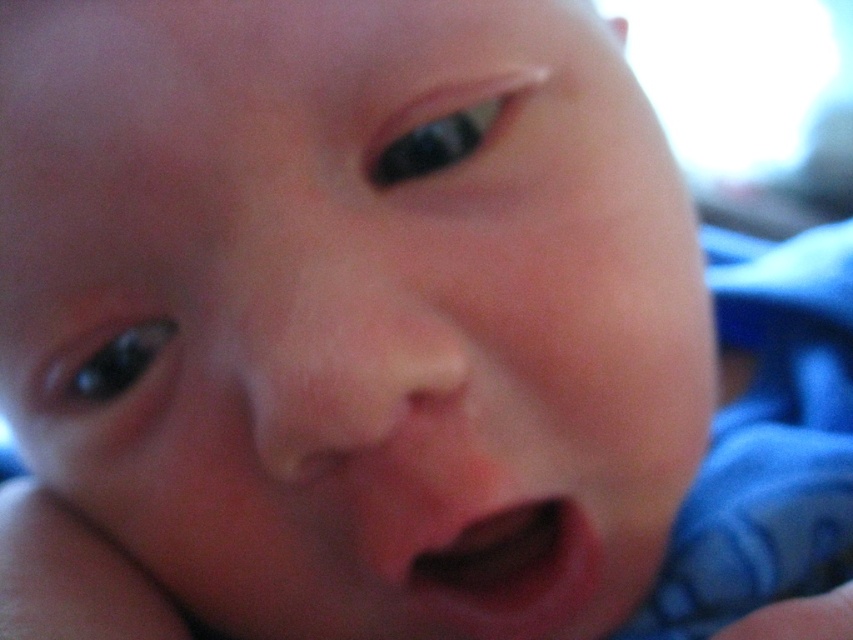
You are a photographer adjusting the focus on a camera. The subject is a baby with a pink smooth flesh at center and a smooth skin hand at lower right. You want to ensure both areas are in focus. Given that the depth of field can only cover 2 inches, will you need to adjust your settings?

The pink smooth flesh at center is 2.57 inches from the smooth skin hand at lower right. Since the depth of field can only cover 2 inches, the distance between them exceeds the depth of field range. Therefore, you will need to adjust your settings to ensure both areas are in focus.

You are a photographer adjusting the focus on a camera. The image shows a baby with two areas of focus. The pink smooth flesh at center and the smooth skin hand at lower right. Which area should you focus on to capture the baby face clearly?

The pink smooth flesh at center is much taller than the smooth skin hand at lower right, so focusing on the pink smooth flesh at center would ensure the baby face is captured clearly.

You are a photographer trying to capture a closeup of a baby. You notice the pink smooth flesh at center and the smooth skin hand at lower right. Which object is positioned to the left side of the other?

The pink smooth flesh at center is to the left of the smooth skin hand at lower right.